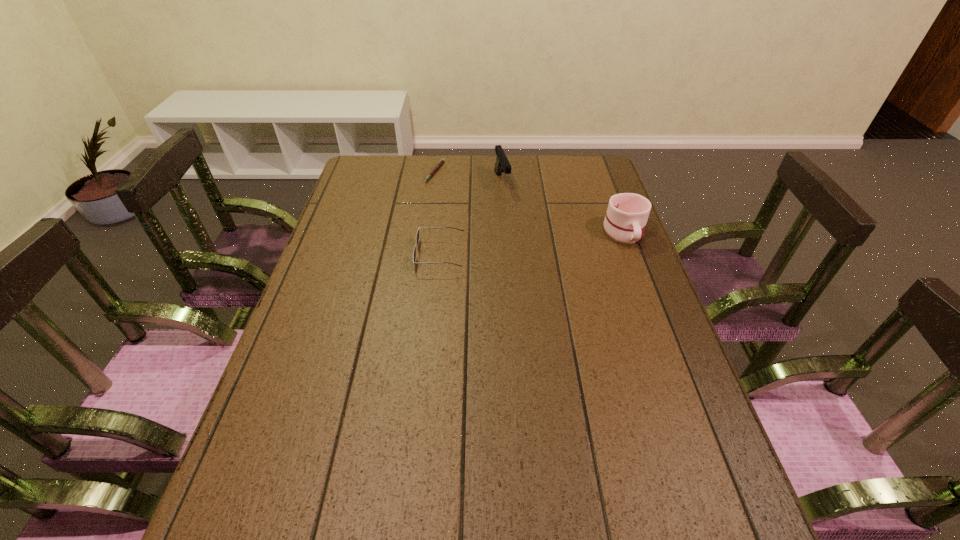
Find the location of a particular element. free space between the shortest object and the rightmost object is located at coordinates (530, 202).

The image size is (960, 540). I want to click on free spot between the second shortest object and the rightmost object, so click(x=532, y=244).

Choose which object is the second nearest neighbor to the mug. Please provide its 2D coordinates. Your answer should be formatted as a tuple, i.e. [(x, y)], where the tuple contains the x and y coordinates of a point satisfying the conditions above.

[(417, 235)]

Identify the location of the closest object to the sunglasses. This screenshot has height=540, width=960. (502, 164).

Where is `free region that satisfies the following two spatial constraints: 1. on the front side of the pistol; 2. on the left side of the shortest object`? free region that satisfies the following two spatial constraints: 1. on the front side of the pistol; 2. on the left side of the shortest object is located at coordinates (434, 181).